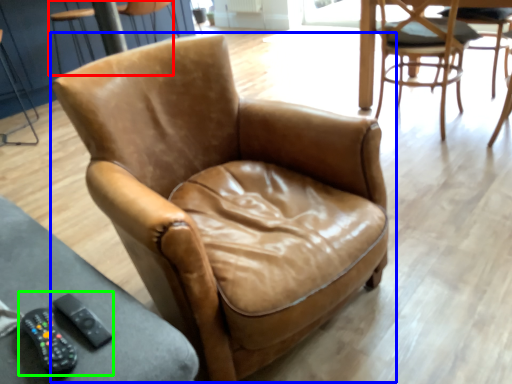
Question: Which object is the closest to the chair (highlighted by a red box)? Choose among these: chair (highlighted by a blue box) or game controller (highlighted by a green box).

Choices:
 (A) chair
 (B) game controller

Answer: (A)